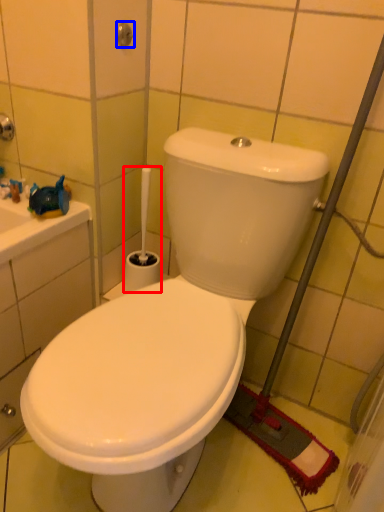
Question: Which object is closer to the camera taking this photo, brush (highlighted by a red box) or shower (highlighted by a blue box)?

Choices:
 (A) brush
 (B) shower

Answer: (B)